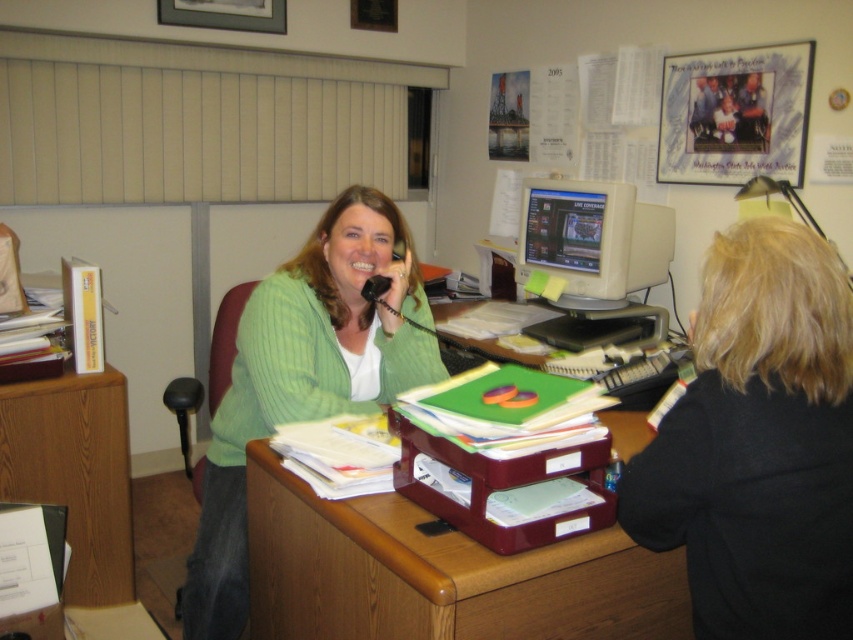
You are an office worker who needs to move a 4.5 feet wide box from the wooden file cabinet at left to the white plastic monitor at center. Can you move the box without it hitting anything?

The wooden file cabinet at left is 4.49 feet from the white plastic monitor at center, so the 4.5 feet wide box would not fit as it requires slightly more space. You may need to adjust the position of either the cabinet or the monitor to accommodate the box.

You are organizing documents in an office. You need to move a file from the wooden file cabinet at left to the white plastic monitor at center. Which direction should you move it?

The wooden file cabinet at left is to the left of the white plastic monitor at center, so you should move the file to the right to place it near the white plastic monitor at center.